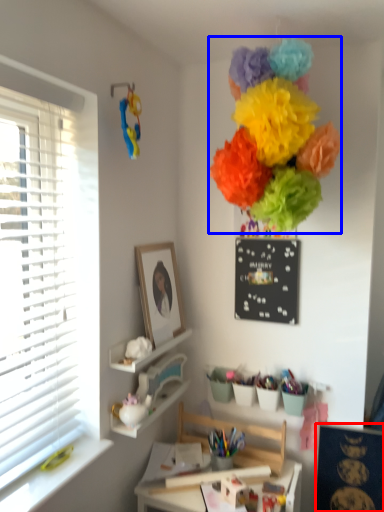
Question: Which object appears closest to the camera in this image, bulletin board (highlighted by a red box) or flower (highlighted by a blue box)?

Choices:
 (A) bulletin board
 (B) flower

Answer: (B)